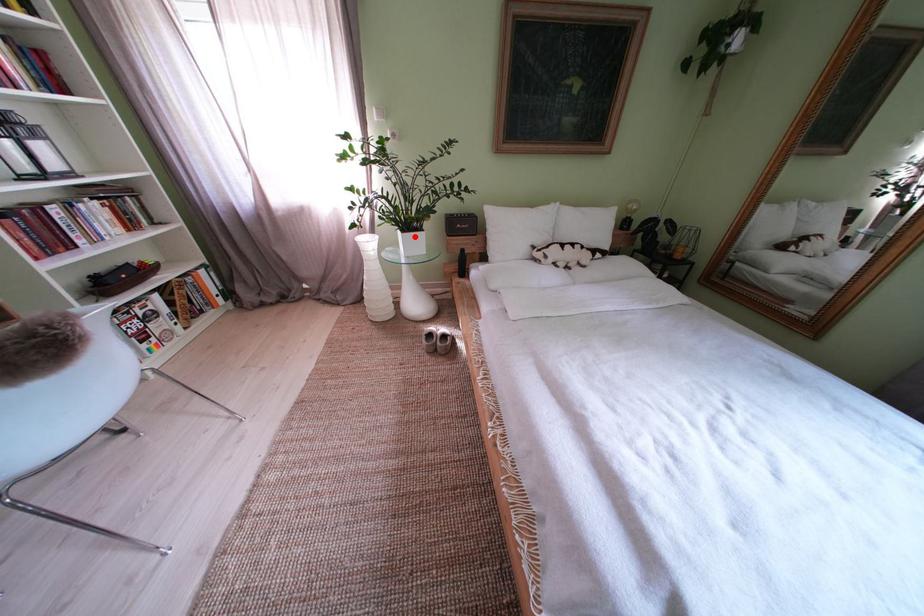
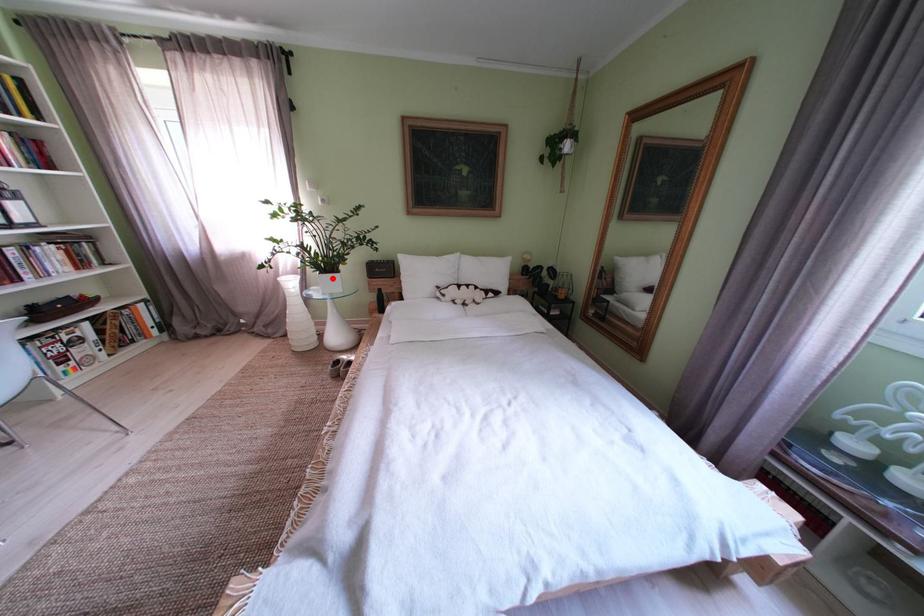
I am providing you with two images of the same scene from different viewpoints. A red point is marked on the first image and another point is marked on the second image. Is the marked point in image1 the same physical position as the marked point in image2?

Yes